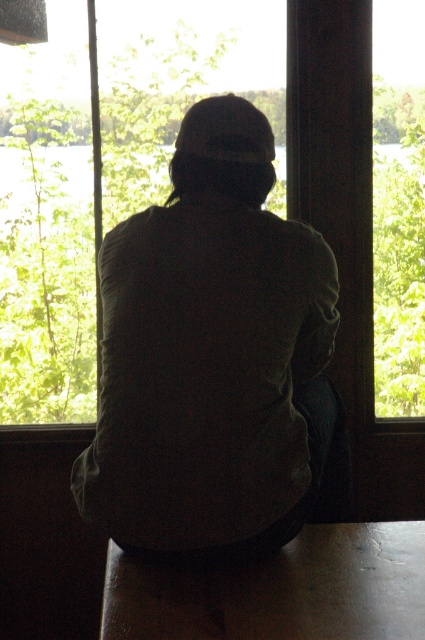
Question: Is dark green fabric at center below transparent glass window at center?

Choices:
 (A) yes
 (B) no

Answer: (A)

Question: Is dark green fabric at center smaller than transparent glass window at center?

Choices:
 (A) yes
 (B) no

Answer: (A)

Question: Which point appears closest to the camera in this image?

Choices:
 (A) (401, 140)
 (B) (311, 410)

Answer: (B)

Question: In this image, where is dark green fabric at center located relative to transparent glass window at center?

Choices:
 (A) left
 (B) right

Answer: (B)

Question: Which point appears closest to the camera in this image?

Choices:
 (A) (209, 252)
 (B) (401, 179)

Answer: (A)